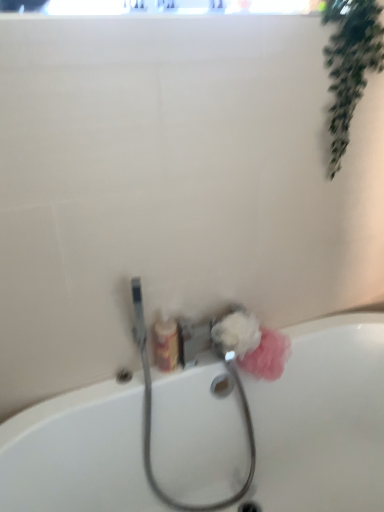
Describe the element at coordinates (323, 419) in the screenshot. The height and width of the screenshot is (512, 384). I see `white ceramic bathtub at lower center` at that location.

What is the approximate height of translucent plastic soap dispenser at lower center?

translucent plastic soap dispenser at lower center is 8.12 inches tall.

Locate an element on the screen. This screenshot has width=384, height=512. green leafy plant at upper right is located at coordinates coord(350,63).

Where is `white fluffy sponge at lower center, the second flower when ordered from right to left`? This screenshot has height=512, width=384. white fluffy sponge at lower center, the second flower when ordered from right to left is located at coordinates (237, 334).

Describe the element at coordinates (267, 356) in the screenshot. I see `pink fluffy sponge at lower right, arranged as the 2th flower when viewed from the left` at that location.

You are a GUI agent. You are given a task and a screenshot of the screen. Output one action in this format:
    pyautogui.click(x=<x>, y=<y>)
    Task: Click on the metallic silver garden hose at lower center
    The width and height of the screenshot is (384, 512).
    Given the screenshot: What is the action you would take?
    pyautogui.click(x=151, y=411)

Is green leafy plant at upper right inside the boundaries of white ceramic bathtub at lower center, or outside?

green leafy plant at upper right is spatially situated outside white ceramic bathtub at lower center.

Would you say green leafy plant at upper right is to the left or to the right of white ceramic bathtub at lower center in the picture?

In the image, green leafy plant at upper right appears on the right side of white ceramic bathtub at lower center.

Does green leafy plant at upper right come in front of white ceramic bathtub at lower center?

No, green leafy plant at upper right is behind white ceramic bathtub at lower center.

Can you confirm if green leafy plant at upper right is smaller than white ceramic bathtub at lower center?

Yes, green leafy plant at upper right is smaller than white ceramic bathtub at lower center.

Can you confirm if white ceramic bathtub at lower center is shorter than pink fluffy sponge at lower right, arranged as the 2th flower when viewed from the left?

No.

Considering the relative positions of white ceramic bathtub at lower center and pink fluffy sponge at lower right, arranged as the 2th flower when viewed from the left, in the image provided, is white ceramic bathtub at lower center to the left of pink fluffy sponge at lower right, arranged as the 2th flower when viewed from the left, from the viewer's perspective?

In fact, white ceramic bathtub at lower center is to the right of pink fluffy sponge at lower right, arranged as the 2th flower when viewed from the left.

Measure the distance between white ceramic bathtub at lower center and pink fluffy sponge at lower right, which appears as the first flower when viewed from the right.

white ceramic bathtub at lower center is 11.75 inches away from pink fluffy sponge at lower right, which appears as the first flower when viewed from the right.

Considering the positions of objects white ceramic bathtub at lower center and pink fluffy sponge at lower right, which appears as the first flower when viewed from the right, in the image provided, who is behind, white ceramic bathtub at lower center or pink fluffy sponge at lower right, which appears as the first flower when viewed from the right,?

pink fluffy sponge at lower right, which appears as the first flower when viewed from the right, is more distant.

Is metallic silver garden hose at lower center touching white ceramic bathtub at lower center?

metallic silver garden hose at lower center and white ceramic bathtub at lower center are clearly separated.

From a real-world perspective, who is located lower, metallic silver garden hose at lower center or white ceramic bathtub at lower center?

white ceramic bathtub at lower center.

In the scene shown: Between metallic silver garden hose at lower center and white ceramic bathtub at lower center, which one has more height?

white ceramic bathtub at lower center.

Is point (150, 468) positioned in front of point (336, 388)?

Yes, point (150, 468) is closer to viewer.

Is translucent plastic soap dispenser at lower center next to white ceramic bathtub at lower center and touching it?

No, translucent plastic soap dispenser at lower center is not touching white ceramic bathtub at lower center.

From the image's perspective, is translucent plastic soap dispenser at lower center above or below white ceramic bathtub at lower center?

Clearly, from the image's perspective, translucent plastic soap dispenser at lower center is above white ceramic bathtub at lower center.

How many degrees apart are the facing directions of translucent plastic soap dispenser at lower center and white ceramic bathtub at lower center?

There is a 5.54-degree angle between the facing directions of translucent plastic soap dispenser at lower center and white ceramic bathtub at lower center.

Does translucent plastic soap dispenser at lower center come in front of white ceramic bathtub at lower center?

No, it is behind white ceramic bathtub at lower center.

From a real-world perspective, is pink fluffy sponge at lower right, arranged as the 2th flower when viewed from the left, above or below metallic silver garden hose at lower center?

Clearly, from a real-world perspective, pink fluffy sponge at lower right, arranged as the 2th flower when viewed from the left, is above metallic silver garden hose at lower center.

Do you think pink fluffy sponge at lower right, arranged as the 2th flower when viewed from the left, is within metallic silver garden hose at lower center, or outside of it?

pink fluffy sponge at lower right, arranged as the 2th flower when viewed from the left, is not inside metallic silver garden hose at lower center, it's outside.

Image resolution: width=384 pixels, height=512 pixels. What are the coordinates of `garden hose that appears in front of the pink fluffy sponge at lower right, arranged as the 2th flower when viewed from the left` in the screenshot? It's located at (151, 411).

Is green leafy plant at upper right at the back of white ceramic bathtub at lower center?

No, white ceramic bathtub at lower center's orientation is not away from green leafy plant at upper right.

I want to click on bathtub in front of the green leafy plant at upper right, so 323,419.

Based on the photo, which of these two, white ceramic bathtub at lower center or green leafy plant at upper right, is wider?

Wider between the two is white ceramic bathtub at lower center.

Which is more to the right, white ceramic bathtub at lower center or green leafy plant at upper right?

green leafy plant at upper right is more to the right.

Which is less distant, (160, 350) or (376, 52)?

Point (160, 350) is positioned farther from the camera compared to point (376, 52).

Can you tell me how much translucent plastic soap dispenser at lower center and green leafy plant at upper right differ in facing direction?

1.75 degrees separate the facing orientations of translucent plastic soap dispenser at lower center and green leafy plant at upper right.

Can you confirm if translucent plastic soap dispenser at lower center is bigger than green leafy plant at upper right?

Actually, translucent plastic soap dispenser at lower center might be smaller than green leafy plant at upper right.

Could you tell me if translucent plastic soap dispenser at lower center is turned towards green leafy plant at upper right?

No.

Image resolution: width=384 pixels, height=512 pixels. Identify the location of plant above the white ceramic bathtub at lower center (from the image's perspective). (350, 63).

From a real-world perspective, count 1st flowers upward from the white ceramic bathtub at lower center and point to it. Please provide its 2D coordinates.

[(267, 356)]

From the image, which object appears to be farther from translucent plastic soap dispenser at lower center, pink fluffy sponge at lower right, arranged as the 2th flower when viewed from the left, or white ceramic bathtub at lower center?

white ceramic bathtub at lower center is positioned further to the anchor translucent plastic soap dispenser at lower center.

In the scene shown: When comparing their distances from green leafy plant at upper right, does translucent plastic soap dispenser at lower center or white fluffy sponge at lower center, the second flower when ordered from right to left, seem further?

The object further to green leafy plant at upper right is translucent plastic soap dispenser at lower center.

Considering their positions, is translucent plastic soap dispenser at lower center positioned further to white fluffy sponge at lower center, which is counted as the 1th flower, starting from the left, than pink fluffy sponge at lower right, arranged as the 2th flower when viewed from the left?

The object further to white fluffy sponge at lower center, which is counted as the 1th flower, starting from the left, is translucent plastic soap dispenser at lower center.

Considering their positions, is white fluffy sponge at lower center, the second flower when ordered from right to left, positioned further to white ceramic bathtub at lower center than pink fluffy sponge at lower right, arranged as the 2th flower when viewed from the left?

The object further to white ceramic bathtub at lower center is white fluffy sponge at lower center, the second flower when ordered from right to left.

Based on their spatial positions, is metallic silver garden hose at lower center or white fluffy sponge at lower center, the second flower when ordered from right to left, closer to green leafy plant at upper right?

The object closer to green leafy plant at upper right is white fluffy sponge at lower center, the second flower when ordered from right to left.

Looking at the image, which one is located closer to white fluffy sponge at lower center, the second flower when ordered from right to left, green leafy plant at upper right or translucent plastic soap dispenser at lower center?

translucent plastic soap dispenser at lower center is closer to white fluffy sponge at lower center, the second flower when ordered from right to left.

Based on the photo, from the image, which object appears to be farther from pink fluffy sponge at lower right, arranged as the 2th flower when viewed from the left, metallic silver garden hose at lower center or white ceramic bathtub at lower center?

white ceramic bathtub at lower center.

Looking at the image, which one is located further to translucent plastic soap dispenser at lower center, white fluffy sponge at lower center, which is counted as the 1th flower, starting from the left, or white ceramic bathtub at lower center?

white ceramic bathtub at lower center is further to translucent plastic soap dispenser at lower center.

What are the coordinates of `flower between translucent plastic soap dispenser at lower center and pink fluffy sponge at lower right, arranged as the 2th flower when viewed from the left` in the screenshot? It's located at (237, 334).

The width and height of the screenshot is (384, 512). Find the location of `toiletry between white ceramic bathtub at lower center and pink fluffy sponge at lower right, arranged as the 2th flower when viewed from the left, from front to back`. toiletry between white ceramic bathtub at lower center and pink fluffy sponge at lower right, arranged as the 2th flower when viewed from the left, from front to back is located at coordinates (165, 344).

The width and height of the screenshot is (384, 512). I want to click on flower between white ceramic bathtub at lower center and translucent plastic soap dispenser at lower center along the z-axis, so click(237, 334).

Locate an element on the screen. The height and width of the screenshot is (512, 384). garden hose between green leafy plant at upper right and white ceramic bathtub at lower center from top to bottom is located at coordinates pyautogui.click(x=151, y=411).